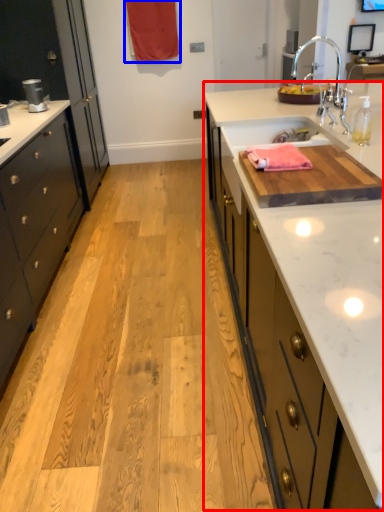
Question: Among these objects, which one is farthest to the camera, countertop (highlighted by a red box) or curtain (highlighted by a blue box)?

Choices:
 (A) countertop
 (B) curtain

Answer: (B)